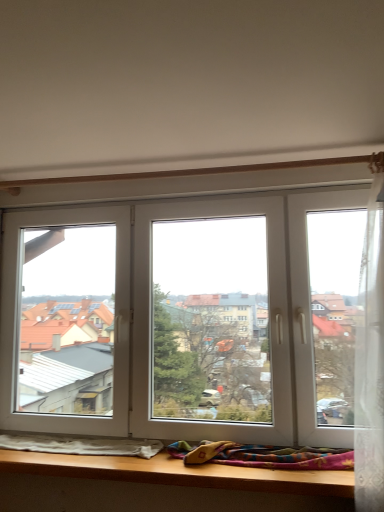
Question: Is point (72, 450) closer or farther from the camera than point (251, 453)?

Choices:
 (A) farther
 (B) closer

Answer: (A)

Question: Based on their positions, is white soft blanket at lower left, which appears as the 2th blanket when viewed from the right, located to the left or right of multicolored woven blanket at lower center, the 2th blanket positioned from the left?

Choices:
 (A) right
 (B) left

Answer: (B)

Question: Relative to multicolored woven blanket at lower center, the 2th blanket positioned from the left, is white soft blanket at lower left, arranged as the first blanket when viewed from the left, in front or behind?

Choices:
 (A) behind
 (B) front

Answer: (A)

Question: Is multicolored woven blanket at lower center, the first blanket when ordered from right to left, inside or outside of white soft blanket at lower left, arranged as the first blanket when viewed from the left?

Choices:
 (A) inside
 (B) outside

Answer: (B)

Question: Visually, is multicolored woven blanket at lower center, the first blanket when ordered from right to left, positioned to the left or to the right of white soft blanket at lower left, which appears as the 2th blanket when viewed from the right?

Choices:
 (A) left
 (B) right

Answer: (B)

Question: Is point (243, 452) closer or farther from the camera than point (119, 441)?

Choices:
 (A) farther
 (B) closer

Answer: (B)

Question: From the image's perspective, is multicolored woven blanket at lower center, the 2th blanket positioned from the left, above or below white soft blanket at lower left, which appears as the 2th blanket when viewed from the right?

Choices:
 (A) below
 (B) above

Answer: (B)